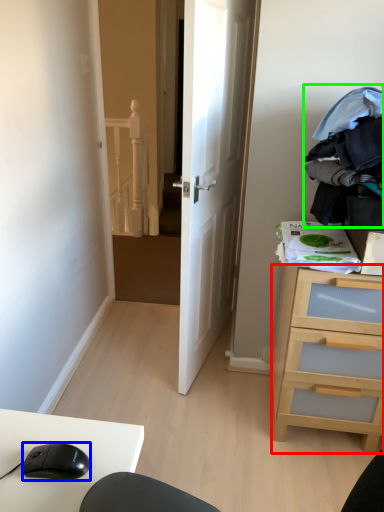
Question: Based on their relative distances, which object is farther from chest of drawers (highlighted by a red box)? Choose from mouse (highlighted by a blue box) and clothing (highlighted by a green box).

Choices:
 (A) mouse
 (B) clothing

Answer: (A)